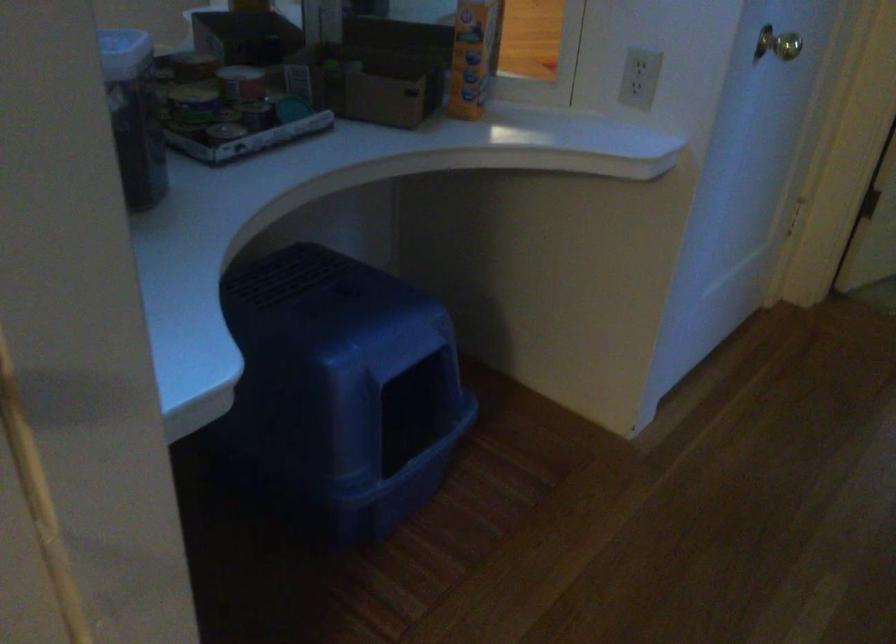
Find where to lift the blue litter box cover. Please return your answer as a coordinate pair (x, y).

(341, 388)